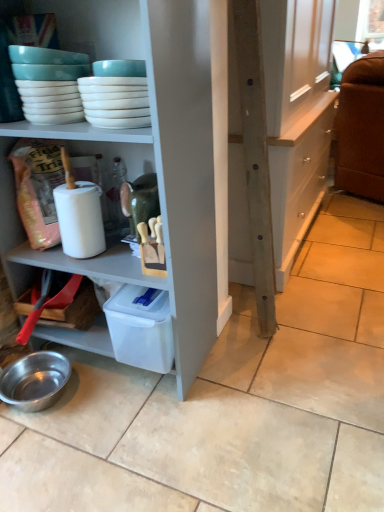
This screenshot has height=512, width=384. What are the coordinates of `vacant area in front of shiny metallic bowl at lower left` in the screenshot? It's located at (41, 444).